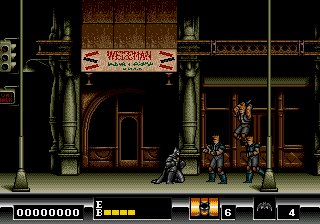
The height and width of the screenshot is (224, 320). Identify the location of door. (134, 139).